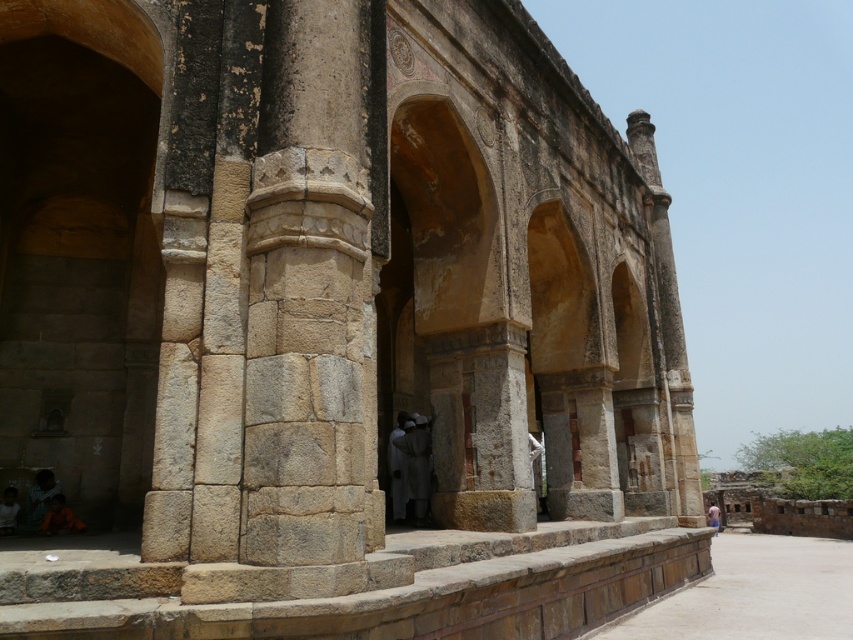
Question: Among these points, which one is nearest to the camera?

Choices:
 (A) (4, 513)
 (B) (718, 509)

Answer: (A)

Question: Which point is closer to the camera?

Choices:
 (A) white stone statue at center
 (B) blue fabric person at center

Answer: (A)

Question: Where is orange fabric person at lower left located in relation to light brown stone person at lower left in the image?

Choices:
 (A) left
 (B) right

Answer: (B)

Question: Where is orange fabric person at lower left located in relation to blue fabric person at center in the image?

Choices:
 (A) right
 (B) left

Answer: (B)

Question: Which point is closer to the camera?

Choices:
 (A) light brown stone person at lower left
 (B) blue fabric person at center
 (C) dark gray stone person at lower left

Answer: (A)

Question: Can you confirm if stone textured column at center is positioned above white stone statue at center?

Choices:
 (A) no
 (B) yes

Answer: (B)